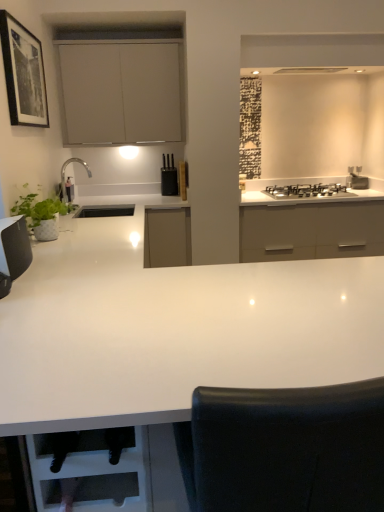
Image resolution: width=384 pixels, height=512 pixels. Describe the element at coordinates (307, 191) in the screenshot. I see `black glass gas stove at upper right` at that location.

This screenshot has height=512, width=384. What do you see at coordinates (121, 92) in the screenshot?
I see `matte white cabinet at upper center` at bounding box center [121, 92].

What do you see at coordinates (23, 74) in the screenshot? I see `black matte picture frame at upper left` at bounding box center [23, 74].

What is the approximate height of black matte knife block at upper center?

black matte knife block at upper center is 14.24 inches tall.

Where is `black matte knife block at upper center`? black matte knife block at upper center is located at coordinates [169, 177].

Where is `black glass gas stove at upper right`? black glass gas stove at upper right is located at coordinates (307, 191).

This screenshot has width=384, height=512. I want to click on gas stove on the right of the white glossy countertop at center, so click(x=307, y=191).

Can you tell me how much white glossy countertop at center and black glass gas stove at upper right differ in facing direction?

There is a 90.2-degree angle between the facing directions of white glossy countertop at center and black glass gas stove at upper right.

From the image's perspective, which one is positioned lower, white glossy countertop at center or black glass gas stove at upper right?

white glossy countertop at center.

Based on their positions, is white glossy countertop at center located to the left or right of black glass gas stove at upper right?

white glossy countertop at center is positioned on black glass gas stove at upper right's left side.

Considering the relative sizes of satin silver stove at upper right and green matte plant at left in the image provided, is satin silver stove at upper right shorter than green matte plant at left?

Yes, satin silver stove at upper right is shorter than green matte plant at left.

From the image's perspective, is satin silver stove at upper right below green matte plant at left?

No.

Considering the relative sizes of satin silver stove at upper right and green matte plant at left in the image provided, is satin silver stove at upper right bigger than green matte plant at left?

No.

Can you tell me how much satin silver stove at upper right and green matte plant at left differ in facing direction?

satin silver stove at upper right and green matte plant at left are facing 89.2 degrees away from each other.

Looking at the image, does satin silver stove at upper right seem bigger or smaller compared to black matte knife block at upper center?

Considering their sizes, satin silver stove at upper right takes up less space than black matte knife block at upper center.

Is satin silver stove at upper right facing away from black matte knife block at upper center?

satin silver stove at upper right is not turned away from black matte knife block at upper center.

From the image's perspective, between satin silver stove at upper right and black matte knife block at upper center, which one is located above?

black matte knife block at upper center is shown above in the image.

Between white glossy countertop at center and matte white cabinet at upper center, which one is positioned behind?

matte white cabinet at upper center is more distant.

Does white glossy countertop at center have a greater width compared to matte white cabinet at upper center?

Yes, white glossy countertop at center is wider than matte white cabinet at upper center.

Which is further, (166, 291) or (88, 42)?

Positioned behind is point (88, 42).

Is black matte knife block at upper center facing towards matte white cabinet at upper center?

No, black matte knife block at upper center is not oriented towards matte white cabinet at upper center.

How different are the orientations of black matte knife block at upper center and matte white cabinet at upper center in degrees?

There is a 0.148-degree angle between the facing directions of black matte knife block at upper center and matte white cabinet at upper center.

Is black matte knife block at upper center inside the boundaries of matte white cabinet at upper center, or outside?

The correct answer is: outside.

From a real-world perspective, between black matte knife block at upper center and matte white cabinet at upper center, who is vertically lower?

black matte knife block at upper center.

Based on their positions, is black glass gas stove at upper right located to the left or right of satin silver stove at upper right?

black glass gas stove at upper right is to the left of satin silver stove at upper right.

From the image's perspective, would you say black glass gas stove at upper right is shown under satin silver stove at upper right?

Correct, black glass gas stove at upper right appears lower than satin silver stove at upper right in the image.

How different are the orientations of black glass gas stove at upper right and satin silver stove at upper right in degrees?

The facing directions of black glass gas stove at upper right and satin silver stove at upper right are 1.26 degrees apart.

Which is more to the right, black matte picture frame at upper left or black glass gas stove at upper right?

black glass gas stove at upper right.

Does black matte picture frame at upper left have a greater height compared to black glass gas stove at upper right?

Indeed, black matte picture frame at upper left has a greater height compared to black glass gas stove at upper right.

Is black matte picture frame at upper left far away from black glass gas stove at upper right?

Absolutely, black matte picture frame at upper left is distant from black glass gas stove at upper right.

You are a GUI agent. You are given a task and a screenshot of the screen. Output one action in this format:
    pyautogui.click(x=<x>, y=<y>)
    Task: Click on the countertop on the left of the black glass gas stove at upper right
    This screenshot has height=512, width=384.
    Given the screenshot: What is the action you would take?
    pyautogui.click(x=173, y=330)

Locate an element on the screen. The image size is (384, 512). appliance on the right side of green matte plant at left is located at coordinates click(x=356, y=178).

Looking at the image, which one is located closer to black glass gas stove at upper right, satin silver stove at upper right or white glossy countertop at center?

satin silver stove at upper right lies closer to black glass gas stove at upper right than the other object.

Considering their positions, is matte white cabinet at upper center positioned closer to green matte plant at left than black glass gas stove at upper right?

matte white cabinet at upper center lies closer to green matte plant at left than the other object.

Looking at the image, which one is located further to green matte plant at left, black matte knife block at upper center or white glossy countertop at center?

black matte knife block at upper center is positioned further to the anchor green matte plant at left.

Estimate the real-world distances between objects in this image. Which object is further from white glossy countertop at center, black matte picture frame at upper left or green matte plant at left?

black matte picture frame at upper left is further to white glossy countertop at center.

Considering their positions, is black matte knife block at upper center positioned further to white glossy countertop at center than satin silver stove at upper right?

The object further to white glossy countertop at center is satin silver stove at upper right.

When comparing their distances from satin silver stove at upper right, does green matte plant at left or black glass gas stove at upper right seem further?

The object further to satin silver stove at upper right is green matte plant at left.

From the image, which object appears to be farther from satin silver stove at upper right, white glossy countertop at center or black matte knife block at upper center?

white glossy countertop at center.

Looking at the image, which one is located further to black matte knife block at upper center, matte white cabinet at upper center or green matte plant at left?

green matte plant at left lies further to black matte knife block at upper center than the other object.

Image resolution: width=384 pixels, height=512 pixels. Identify the location of plant between black matte picture frame at upper left and black glass gas stove at upper right. (39, 208).

At what (x,y) coordinates should I click in order to perform the action: click on kitchen appliance between black matte picture frame at upper left and satin silver stove at upper right from left to right. Please return your answer as a coordinate pair (x, y). Looking at the image, I should click on (169, 177).

Where is `cabinetry between green matte plant at left and black glass gas stove at upper right from left to right`? cabinetry between green matte plant at left and black glass gas stove at upper right from left to right is located at coordinates (121, 92).

At what (x,y) coordinates should I click in order to perform the action: click on cabinetry between green matte plant at left and satin silver stove at upper right. Please return your answer as a coordinate pair (x, y). The height and width of the screenshot is (512, 384). Looking at the image, I should click on (121, 92).